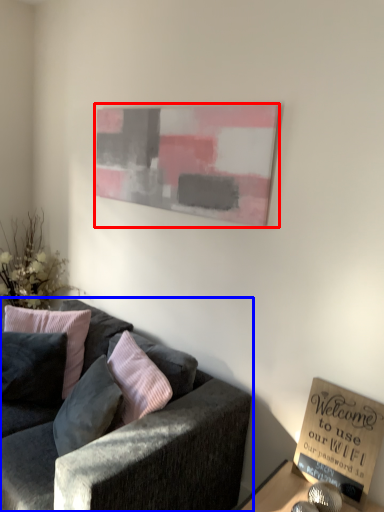
Question: Which point is closer to the camera, picture frame (highlighted by a red box) or studio couch (highlighted by a blue box)?

Choices:
 (A) picture frame
 (B) studio couch

Answer: (B)